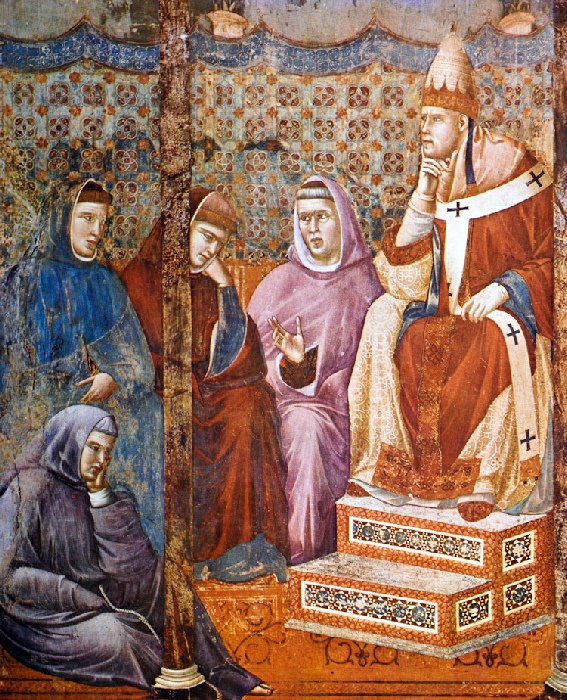
Locate an element on the screen. The height and width of the screenshot is (700, 567). small staircase is located at coordinates (393, 573), (424, 512).